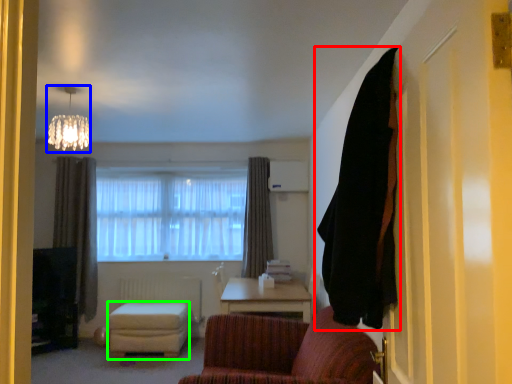
Question: Based on their relative distances, which object is nearer to curtain (highlighted by a red box)? Choose from lamp (highlighted by a blue box) and stool (highlighted by a green box).

Choices:
 (A) lamp
 (B) stool

Answer: (A)